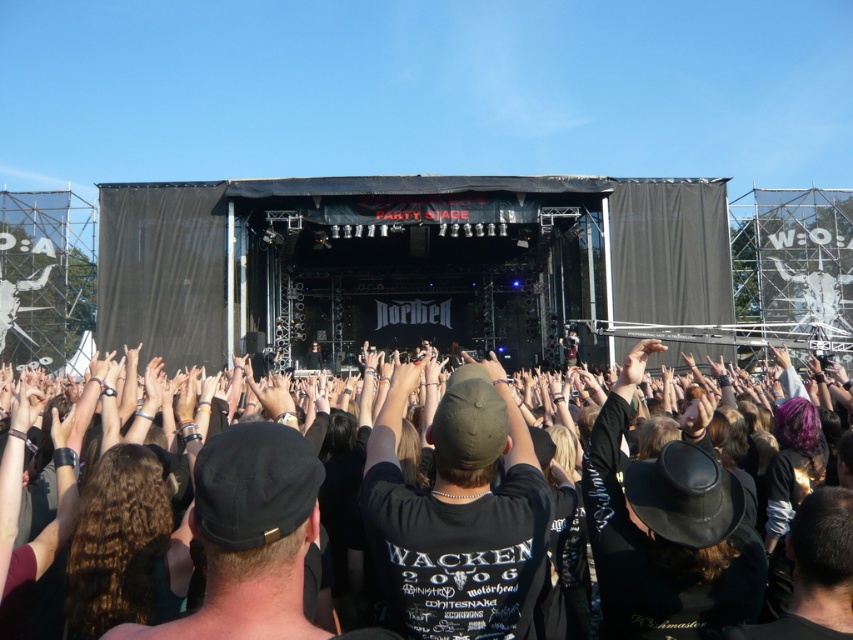
Question: Which of the following is the farthest from the observer?

Choices:
 (A) black matte cap at center
 (B) black fabric crowd at center

Answer: (A)

Question: Where is black fabric crowd at center located in relation to black matte cap at center in the image?

Choices:
 (A) left
 (B) right

Answer: (A)

Question: Among these objects, which one is farthest from the camera?

Choices:
 (A) black matte cap at center
 (B) black fabric crowd at center

Answer: (A)

Question: Is black fabric crowd at center smaller than black matte cap at center?

Choices:
 (A) no
 (B) yes

Answer: (A)

Question: Can you confirm if black fabric crowd at center is positioned above black matte cap at center?

Choices:
 (A) yes
 (B) no

Answer: (A)